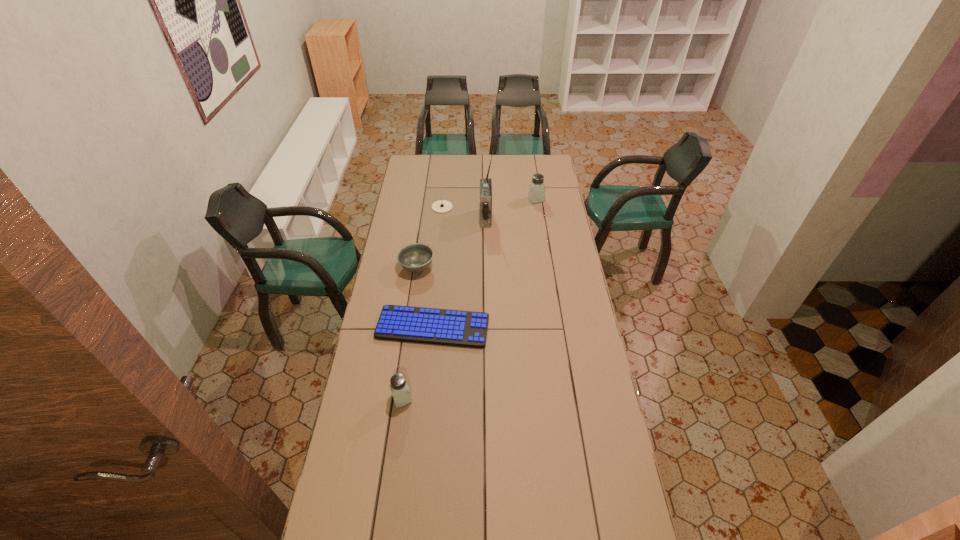
Find the location of a particular element. vacant space located on the front of the left saltshaker is located at coordinates (396, 435).

Find the location of `vacant position located 0.210m on the back of the farther saltshaker`. vacant position located 0.210m on the back of the farther saltshaker is located at coordinates (532, 175).

You are a GUI agent. You are given a task and a screenshot of the screen. Output one action in this format:
    pyautogui.click(x=<x>, y=<y>)
    Task: Click on the free location located 0.130m on the front of the bowl
    
    Given the screenshot: What is the action you would take?
    pyautogui.click(x=412, y=301)

The image size is (960, 540). Identify the location of free spot located 0.070m on the front of the second shortest object. (441, 221).

The image size is (960, 540). I want to click on vacant area located on the display of the tallest object, so click(431, 219).

The width and height of the screenshot is (960, 540). Identify the location of blank space located on the display of the tallest object. (470, 219).

Identify the location of free location located on the display of the tallest object. This screenshot has width=960, height=540. (427, 219).

What are the coordinates of `free space located on the front of the second nearest object` in the screenshot? It's located at (430, 359).

The width and height of the screenshot is (960, 540). Identify the location of saltshaker positioned at the left edge. (399, 388).

I want to click on bowl that is at the left edge, so click(416, 257).